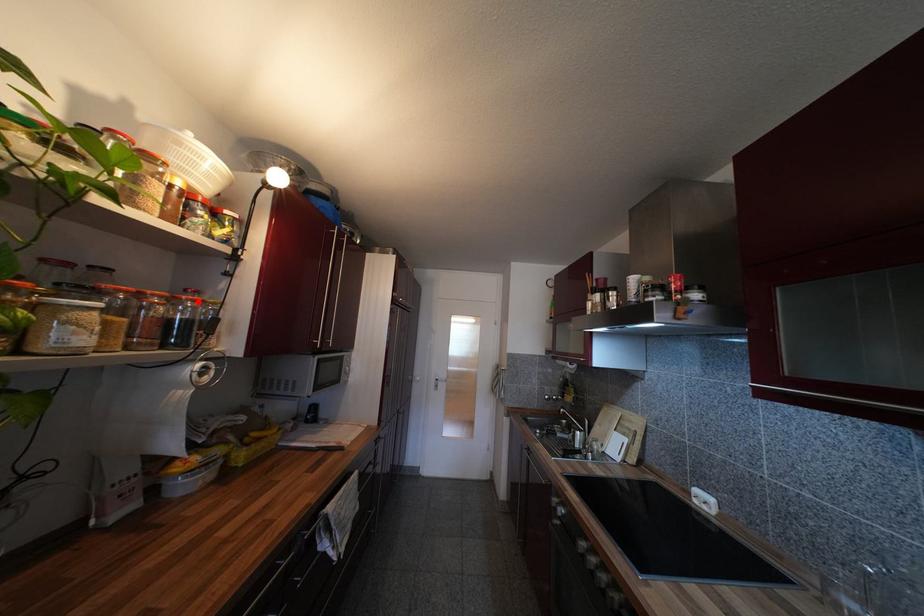
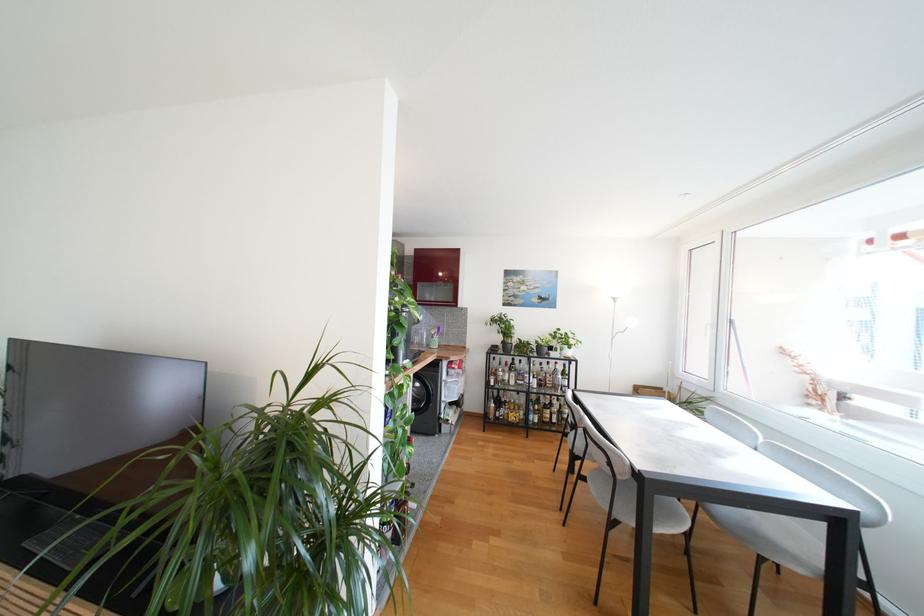
Question: I am providing you with two images of the same scene from different viewpoints. A red point is marked on the first image. Is the red point's position out of view in image 2?

Choices:
 (A) Yes
 (B) No

Answer: (A)